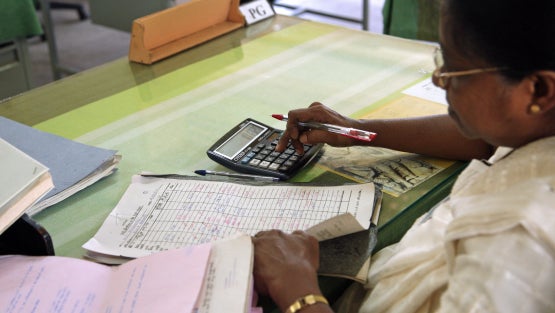
This screenshot has height=313, width=555. Find the location of `brown container for business cards`. brown container for business cards is located at coordinates click(x=179, y=35).